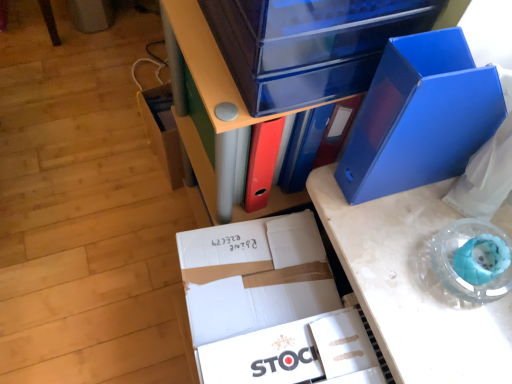
Identify the location of vacant point above blue plastic desk at center (from a real-world perspective). (445, 263).